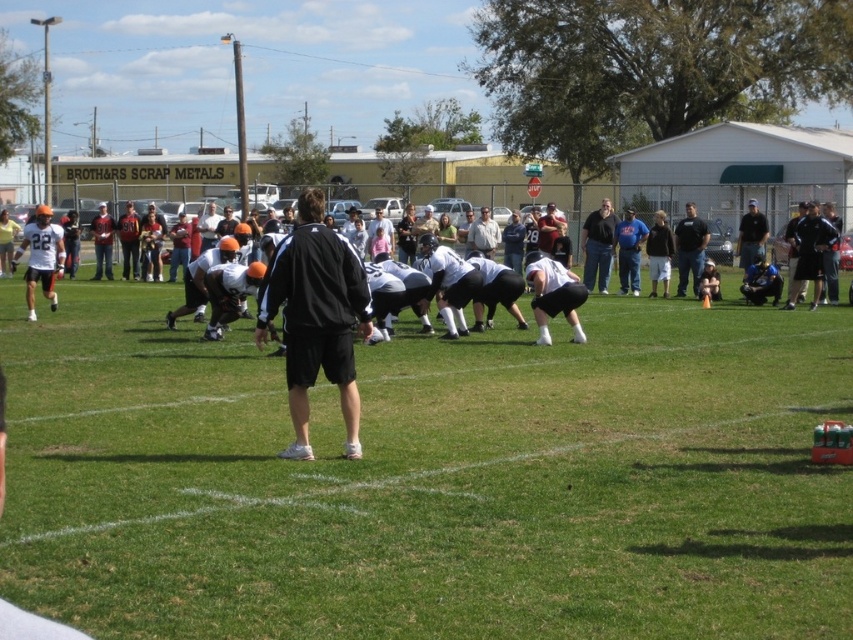
You are a photographer trying to capture a wide shot of the football practice. The green grass field at center and the black matte jacket at center are both in your frame. Which object will occupy more space in your photo?

The green grass field at center is larger in size than the black matte jacket at center, so it will occupy more space in the photo.

You are a player wearing a dark blue shirt at center. You need to pass a ball to your teammate wearing a dark gray shirt at right. The ball you have is 0.7 meters in diameter. Can you kick the ball directly to your teammate without it bouncing first? Explain your reasoning.

The distance between the dark gray shirt at right and the dark blue shirt at center is 1.14 meters. Since the ball has a diameter of 0.7 meters, it can travel the required distance without bouncing because the distance is greater than the ball size, allowing it to roll smoothly.

What is located at the coordinates point (598, 244)?

The black matte shirt at center is located at point (598, 244).